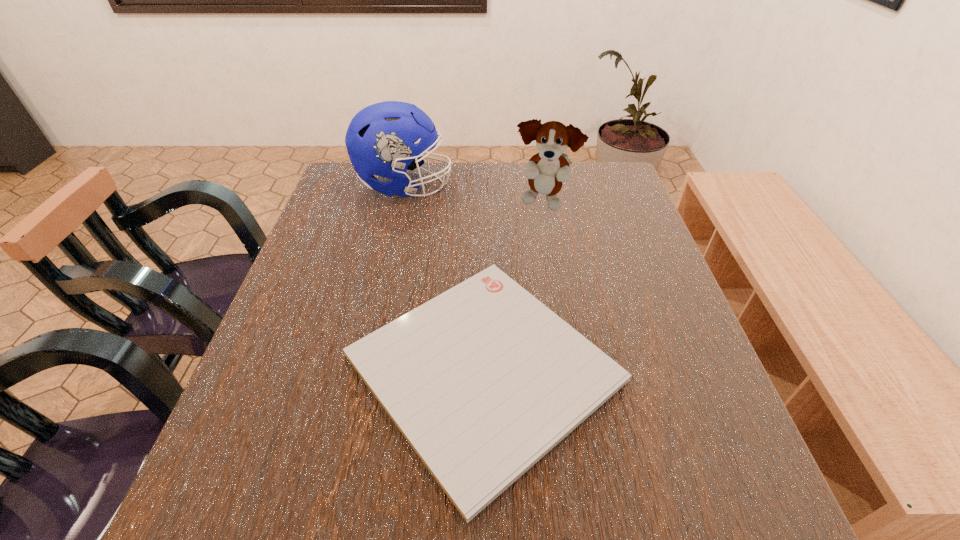
The image size is (960, 540). I want to click on free space between the shortest object and the football helmet, so pos(444,276).

What are the coordinates of `free spot between the football helmet and the puppy` in the screenshot? It's located at (473, 194).

You are a GUI agent. You are given a task and a screenshot of the screen. Output one action in this format:
    pyautogui.click(x=<x>, y=<y>)
    Task: Click on the empty space between the football helmet and the clipboard
    Image resolution: width=960 pixels, height=540 pixels.
    Given the screenshot: What is the action you would take?
    pyautogui.click(x=444, y=276)

Where is `unoccupied position between the football helmet and the shortest object`? The image size is (960, 540). unoccupied position between the football helmet and the shortest object is located at coordinates (444, 276).

Locate an element on the screen. The height and width of the screenshot is (540, 960). empty space between the clipboard and the football helmet is located at coordinates (444, 276).

Locate an element on the screen. This screenshot has width=960, height=540. vacant space that is in between the football helmet and the puppy is located at coordinates (473, 194).

Identify which object is the second nearest to the football helmet. Please provide its 2D coordinates. Your answer should be formatted as a tuple, i.e. [(x, y)], where the tuple contains the x and y coordinates of a point satisfying the conditions above.

[(483, 380)]

What are the coordinates of `the closest object relative to the shortest object` in the screenshot? It's located at [546, 170].

Locate an element on the screen. vacant area that satisfies the following two spatial constraints: 1. on the face guard of the shortest object; 2. on the left side of the football helmet is located at coordinates (363, 368).

This screenshot has height=540, width=960. In order to click on free space that satisfies the following two spatial constraints: 1. on the face guard of the football helmet; 2. on the right side of the clipboard in this screenshot , I will do `click(363, 368)`.